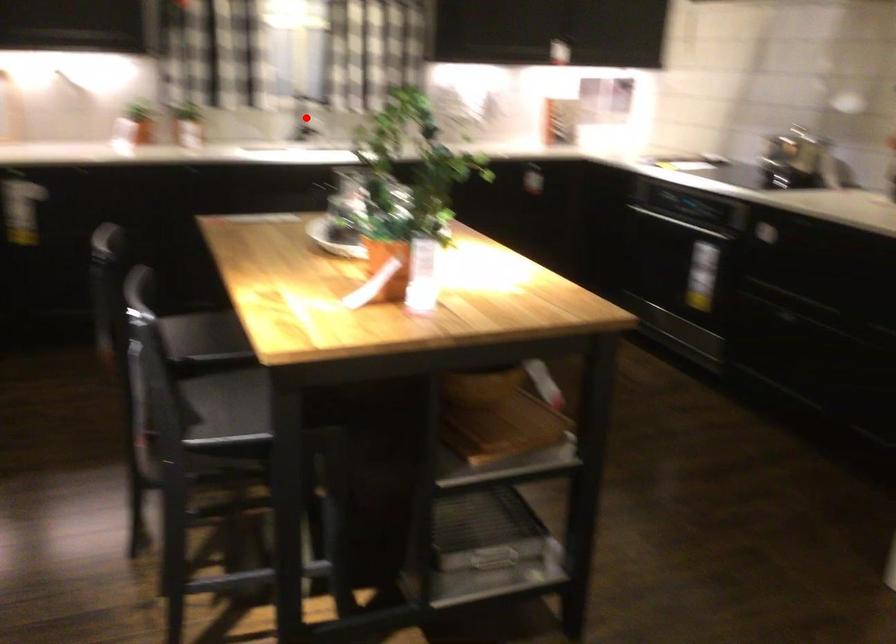
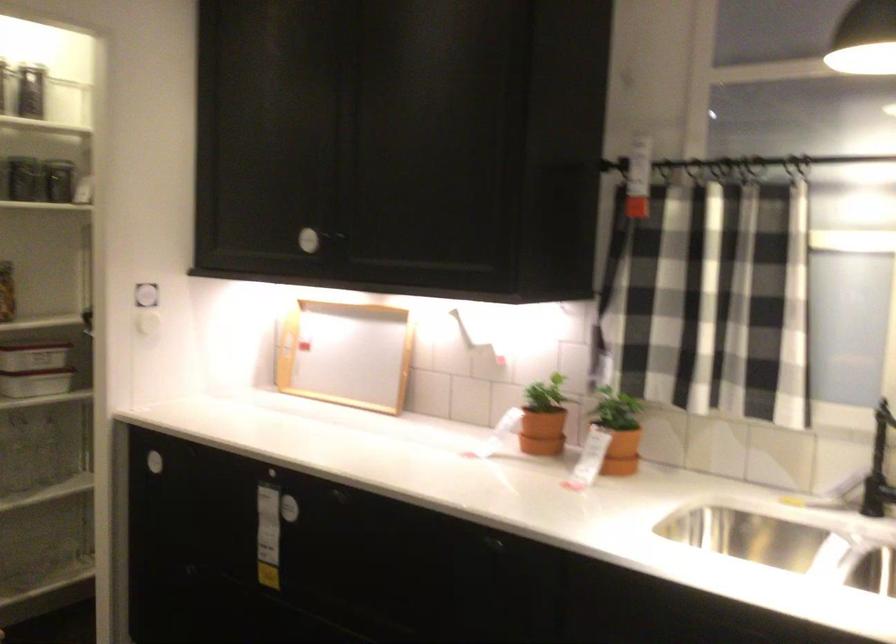
Question: I am providing you with two images of the same scene from different viewpoints. A red point is shown in image1. For the corresponding object point in image2, is it positioned nearer or farther from the camera?

Choices:
 (A) Nearer
 (B) Farther

Answer: (A)